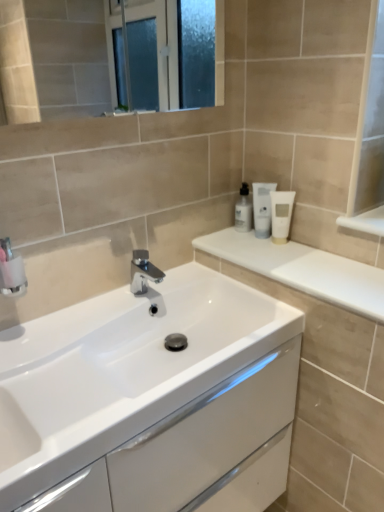
Question: Can white matte tube at upper right, which is the 3th toiletry in left-to-right order, be found inside chrome metallic faucet at center?

Choices:
 (A) no
 (B) yes

Answer: (A)

Question: Does chrome metallic faucet at center appear on the left side of white matte tube at upper right, which is the 3th toiletry in left-to-right order?

Choices:
 (A) yes
 (B) no

Answer: (A)

Question: Does chrome metallic faucet at center have a lesser height compared to white matte tube at upper right, which is the 3th toiletry in left-to-right order?

Choices:
 (A) yes
 (B) no

Answer: (A)

Question: Considering the relative sizes of chrome metallic faucet at center and white matte tube at upper right, which is the 1th toiletry in right-to-left order, in the image provided, is chrome metallic faucet at center smaller than white matte tube at upper right, which is the 1th toiletry in right-to-left order,?

Choices:
 (A) yes
 (B) no

Answer: (B)

Question: Is chrome metallic faucet at center far from white matte tube at upper right, which is the 3th toiletry in left-to-right order?

Choices:
 (A) yes
 (B) no

Answer: (B)

Question: In terms of width, does white matte tube at upper right, which is the second toiletry in left-to-right order, look wider or thinner when compared to white glossy cabinet at center?

Choices:
 (A) wide
 (B) thin

Answer: (B)

Question: Is white matte tube at upper right, which is the second toiletry in left-to-right order, to the left or to the right of white glossy cabinet at center in the image?

Choices:
 (A) right
 (B) left

Answer: (A)

Question: Would you say white matte tube at upper right, which is the second toiletry in left-to-right order, is inside or outside white glossy cabinet at center?

Choices:
 (A) inside
 (B) outside

Answer: (B)

Question: Considering the positions of point (261, 218) and point (105, 465), is point (261, 218) closer or farther from the camera than point (105, 465)?

Choices:
 (A) closer
 (B) farther

Answer: (B)

Question: Is chrome metallic faucet at center bigger or smaller than white matte tube at upper right, which is the second toiletry in left-to-right order?

Choices:
 (A) small
 (B) big

Answer: (B)

Question: Which is correct: chrome metallic faucet at center is inside white matte tube at upper right, which is the 2th toiletry from right to left, or outside of it?

Choices:
 (A) outside
 (B) inside

Answer: (A)

Question: Does point (152, 280) appear closer or farther from the camera than point (266, 224)?

Choices:
 (A) farther
 (B) closer

Answer: (B)

Question: From a real-world perspective, relative to white matte tube at upper right, which is the second toiletry in left-to-right order, is chrome metallic faucet at center vertically above or below?

Choices:
 (A) above
 (B) below

Answer: (B)

Question: Is white glossy cabinet at center in front of or behind white glossy lotion at upper right, arranged as the first toiletry when viewed from the left, in the image?

Choices:
 (A) behind
 (B) front

Answer: (B)

Question: Is white glossy cabinet at center situated inside white glossy lotion at upper right, the 3th toiletry in the right-to-left sequence, or outside?

Choices:
 (A) outside
 (B) inside

Answer: (A)